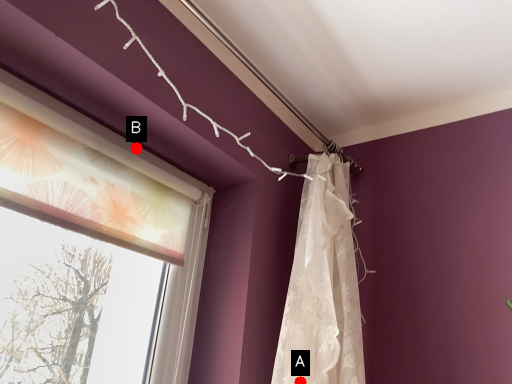
Question: Two points are circled on the image, labeled by A and B beside each circle. Which of the following is the farthest from the observer?

Choices:
 (A) A is further
 (B) B is further

Answer: (B)